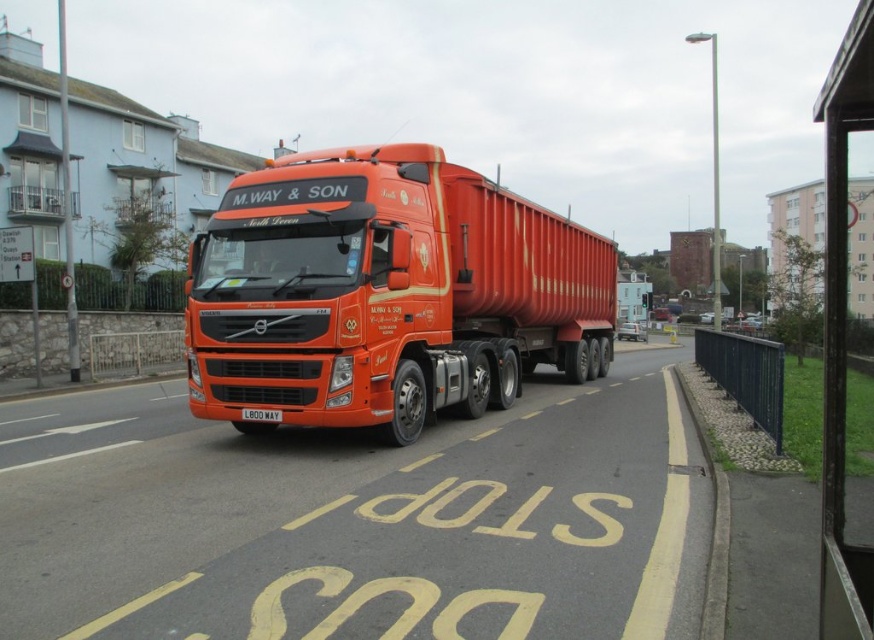
Question: Which object is closer to the camera taking this photo?

Choices:
 (A) shiny orange trailer truck at center
 (B) white plastic license plate at center

Answer: (A)

Question: Can you confirm if shiny orange trailer truck at center is positioned to the left of white plastic license plate at center?

Choices:
 (A) no
 (B) yes

Answer: (B)

Question: Can you confirm if shiny orange trailer truck at center is thinner than white plastic license plate at center?

Choices:
 (A) yes
 (B) no

Answer: (B)

Question: Can you confirm if shiny orange trailer truck at center is wider than white plastic license plate at center?

Choices:
 (A) yes
 (B) no

Answer: (A)

Question: Which point is farther to the camera?

Choices:
 (A) (338, 292)
 (B) (257, 419)

Answer: (B)